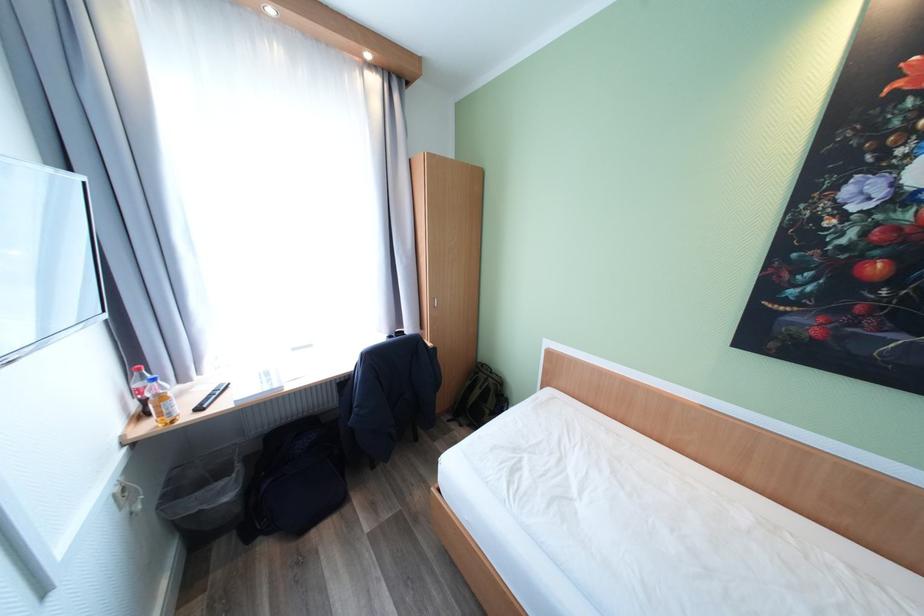
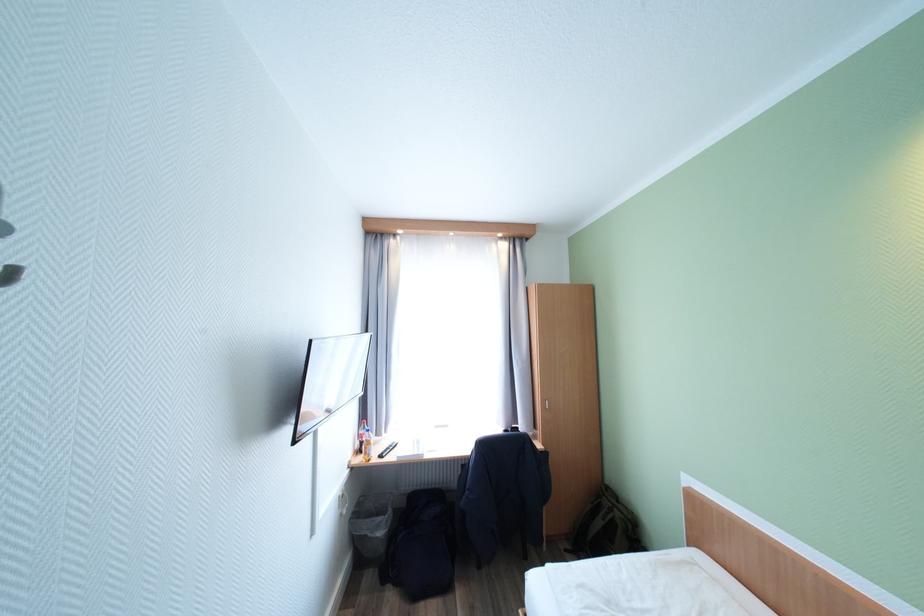
Where in the second image is the point corresponding to point 236,498 from the first image?

(387, 535)